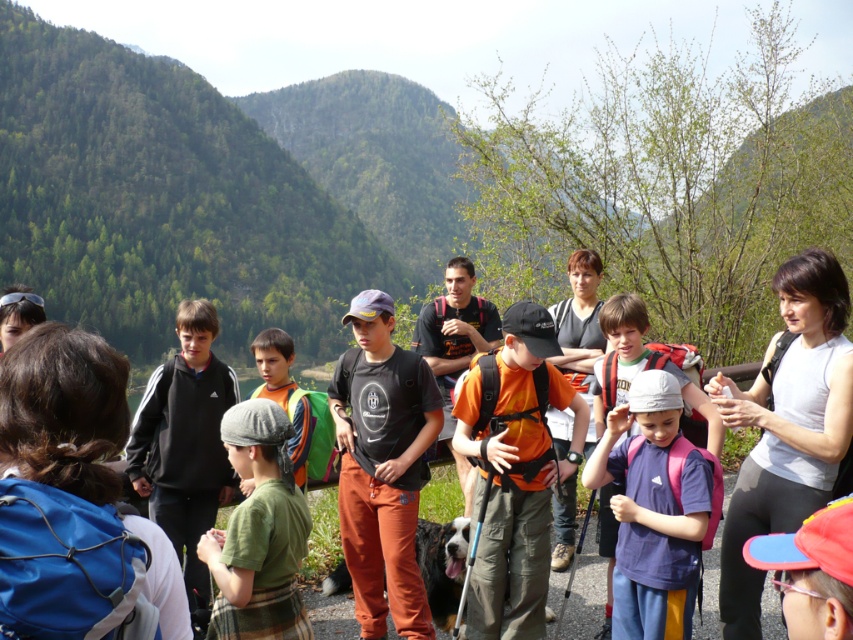
Question: Which object is closer to the camera taking this photo?

Choices:
 (A) orange fabric backpack at center
 (B) purple matte shirt at center

Answer: (B)

Question: Which point is farther to the camera?

Choices:
 (A) purple matte shirt at center
 (B) green forested mountain at center
 (C) orange fabric backpack at center
 (D) green cotton shirt at center

Answer: (B)

Question: Among these objects, which one is farthest from the camera?

Choices:
 (A) orange fabric backpack at center
 (B) green forested mountain at center
 (C) green cotton shirt at center
 (D) purple matte shirt at center

Answer: (B)

Question: Can you confirm if purple matte shirt at center is positioned to the left of orange fabric backpack at center?

Choices:
 (A) no
 (B) yes

Answer: (A)

Question: Observing the image, what is the correct spatial positioning of green forested mountain at center in reference to orange fabric backpack at center?

Choices:
 (A) right
 (B) left

Answer: (B)

Question: Is green forested mountain at center thinner than purple matte shirt at center?

Choices:
 (A) no
 (B) yes

Answer: (A)